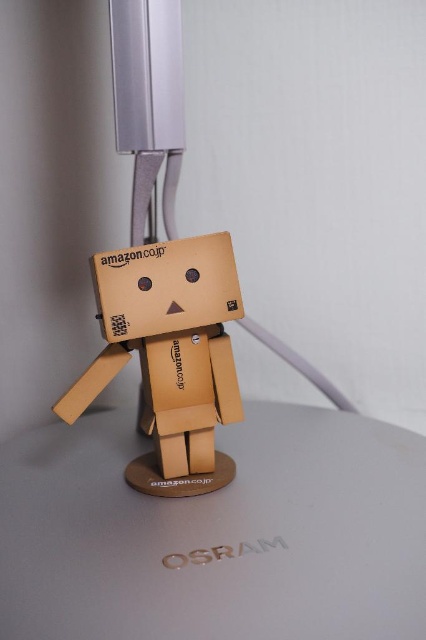
You are standing in a room and see the point at coordinates [216,532]. According to the scene, what is the surface that this point is located on?

The point at coordinates [216,532] is located on the matte gray table at center.

You are standing in front of the Danbo figurine on the desk. There are two points marked on the desk surface, point 1 at coordinates point (114, 442) and point 2 at coordinates point (215, 410). Which point is closer to you?

Point 2 at coordinates point (215, 410) is closer to you because the description states that point (114, 442) is behind point (215, 410), meaning point (215, 410) is in front and therefore closer.

You are placing a matte gray table at center and a matte cardboard figure at center in a room. Which object is positioned lower?

The matte gray table at center is positioned lower than the matte cardboard figure at center.